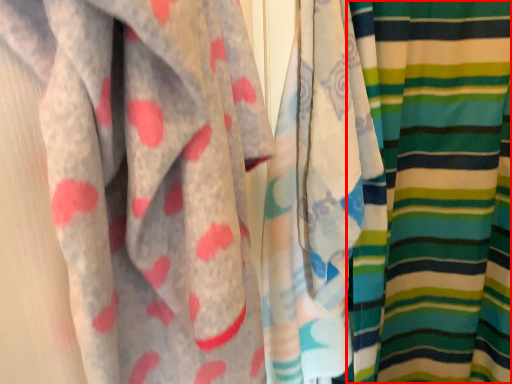
Question: From the image's perspective, where is curtain (annotated by the red box) located relative to curtain?

Choices:
 (A) below
 (B) above

Answer: (A)